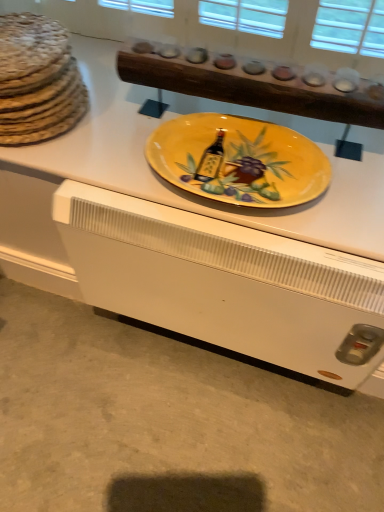
The height and width of the screenshot is (512, 384). I want to click on free space below yellow ceramic plate at center (from a real-world perspective), so click(x=242, y=167).